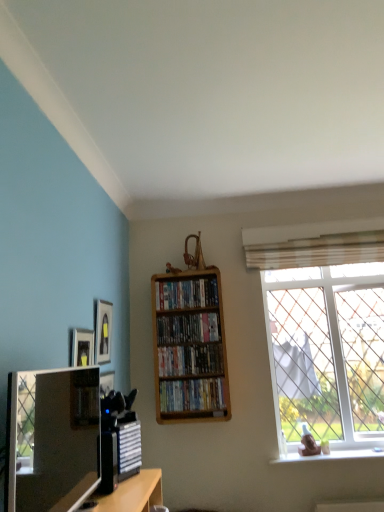
I want to click on free location above wooden bookshelf at center, the fourth book from the top (from a real-world perspective), so [199, 377].